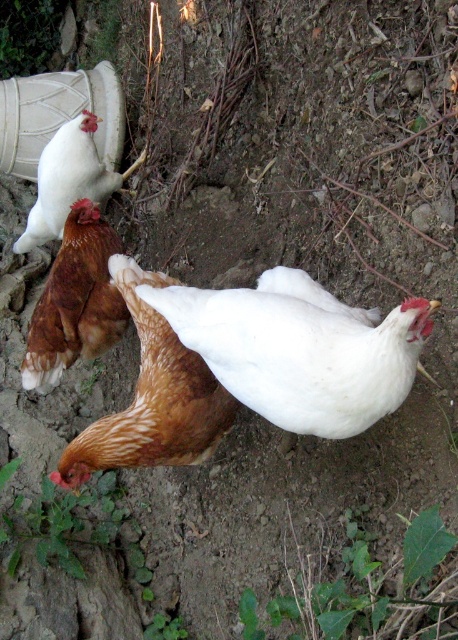
Question: Which object is the closest to the white matte chicken at center?

Choices:
 (A) brown speckled chicken at center
 (B) brown feathered chicken at upper left
 (C) brown feathered chicken at center

Answer: (A)

Question: Can you confirm if white matte chicken at center is positioned below brown feathered chicken at center?

Choices:
 (A) yes
 (B) no

Answer: (A)

Question: Can you confirm if white matte chicken at center is positioned to the right of brown feathered chicken at upper left?

Choices:
 (A) yes
 (B) no

Answer: (A)

Question: Is white matte chicken at center behind brown speckled chicken at center?

Choices:
 (A) no
 (B) yes

Answer: (A)

Question: Estimate the real-world distances between objects in this image. Which object is closer to the brown feathered chicken at upper left?

Choices:
 (A) white matte chicken at center
 (B) brown feathered chicken at center
 (C) brown speckled chicken at center

Answer: (B)

Question: Estimate the real-world distances between objects in this image. Which object is closer to the brown speckled chicken at center?

Choices:
 (A) white matte chicken at center
 (B) brown feathered chicken at upper left
 (C) brown feathered chicken at center

Answer: (A)